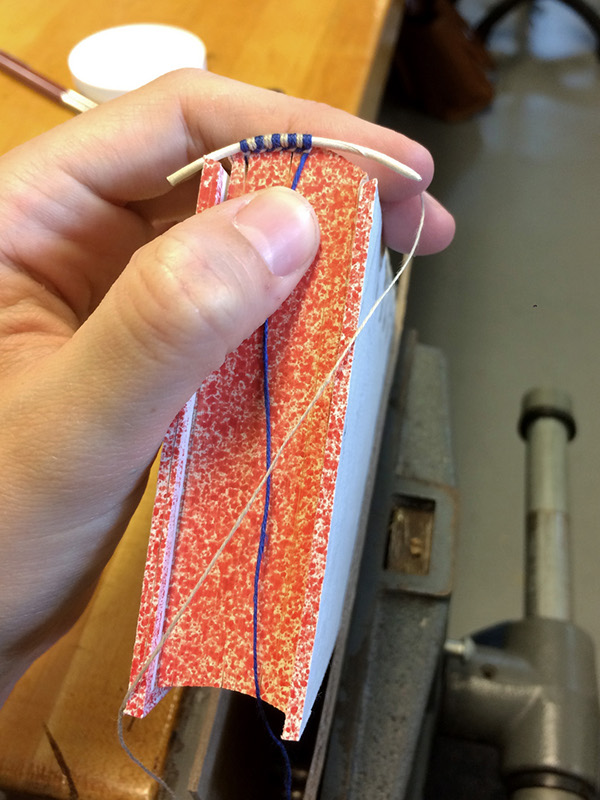
The image size is (600, 800). I want to click on cup, so click(x=116, y=90).